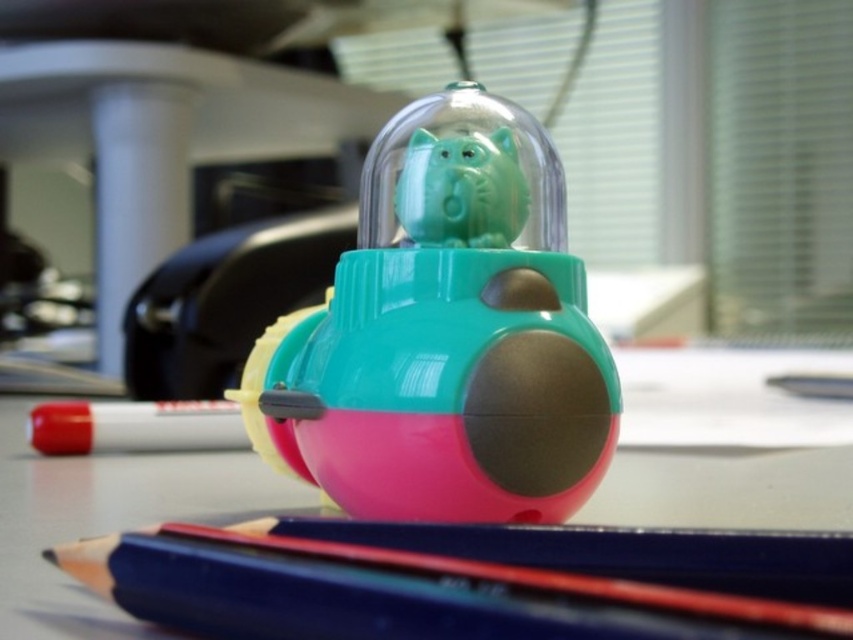
Consider the image. Can you confirm if matte green plastic piggy bank at center is smaller than red matte marker at lower left?

Indeed, matte green plastic piggy bank at center has a smaller size compared to red matte marker at lower left.

Is matte green plastic piggy bank at center above red matte marker at lower left?

Correct, matte green plastic piggy bank at center is located above red matte marker at lower left.

Which is behind, point (460, 138) or point (49, 444)?

Positioned behind is point (49, 444).

Locate an element on the screen. matte green plastic piggy bank at center is located at coordinates (461, 189).

How far apart are matte plastic toy at center and red matte marker at lower left?

matte plastic toy at center and red matte marker at lower left are 18.53 inches apart from each other.

Which is behind, point (410, 392) or point (68, 452)?

The point (68, 452) is behind.

Which is behind, point (497, 241) or point (207, 445)?

The point (207, 445) is more distant.

Find the location of a particular element. matte plastic toy at center is located at coordinates (445, 333).

Is matte plastic toy at center bigger than smooth blue pencil at center?

Indeed, matte plastic toy at center has a larger size compared to smooth blue pencil at center.

From the picture: Is matte plastic toy at center to the right of smooth blue pencil at center from the viewer's perspective?

Incorrect, matte plastic toy at center is not on the right side of smooth blue pencil at center.

This screenshot has width=853, height=640. Describe the element at coordinates (445, 333) in the screenshot. I see `matte plastic toy at center` at that location.

Find the location of a particular element. matte plastic toy at center is located at coordinates (445, 333).